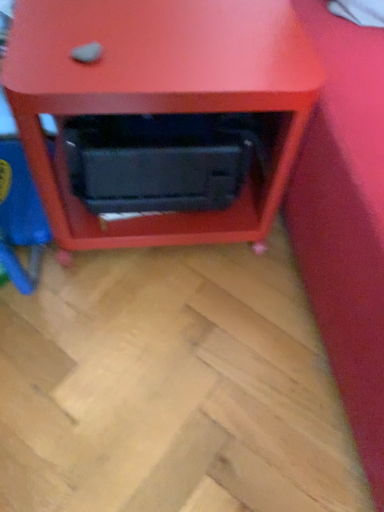
Question: From the image's perspective, is matte black microwave at center positioned above or below black plastic drawer at center?

Choices:
 (A) above
 (B) below

Answer: (A)

Question: Would you say matte black microwave at center is inside or outside black plastic drawer at center?

Choices:
 (A) inside
 (B) outside

Answer: (B)

Question: Relative to black plastic drawer at center, is matte black microwave at center in front or behind?

Choices:
 (A) front
 (B) behind

Answer: (A)

Question: Is black plastic drawer at center bigger or smaller than matte black microwave at center?

Choices:
 (A) big
 (B) small

Answer: (B)

Question: In terms of height, does black plastic drawer at center look taller or shorter compared to matte black microwave at center?

Choices:
 (A) short
 (B) tall

Answer: (A)

Question: Considering the relative positions of black plastic drawer at center and matte black microwave at center in the image provided, is black plastic drawer at center to the left or to the right of matte black microwave at center?

Choices:
 (A) left
 (B) right

Answer: (A)

Question: Does point (127, 204) appear closer or farther from the camera than point (206, 242)?

Choices:
 (A) closer
 (B) farther

Answer: (A)